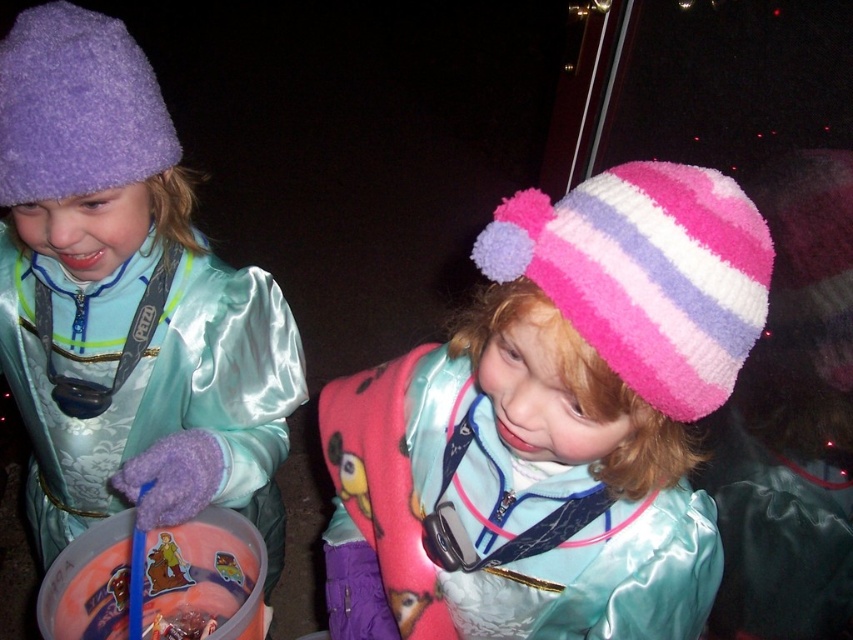
Question: Among these points, which one is farthest from the camera?

Choices:
 (A) (672, 304)
 (B) (639, 348)
 (C) (144, 138)
 (D) (192, 435)

Answer: (D)

Question: Which point is closer to the camera?

Choices:
 (A) (113, 170)
 (B) (393, 550)
 (C) (53, 461)

Answer: (B)

Question: Does pink striped knit hat at upper right have a lesser width compared to purple fuzzy hat at upper left?

Choices:
 (A) no
 (B) yes

Answer: (A)

Question: Where is pink fuzzy hat at center located in relation to matte purple hat at left in the image?

Choices:
 (A) above
 (B) below

Answer: (B)

Question: Among these objects, which one is nearest to the camera?

Choices:
 (A) matte purple hat at left
 (B) purple fuzzy hat at upper left

Answer: (B)

Question: Does pink fuzzy hat at center appear over matte purple hat at left?

Choices:
 (A) no
 (B) yes

Answer: (A)